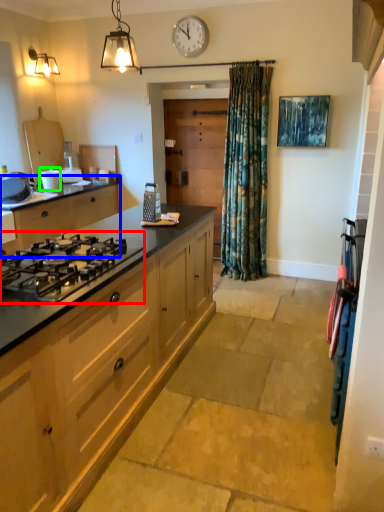
Question: Based on their relative distances, which object is farther from gas stove (highlighted by a red box)? Choose from cabinetry (highlighted by a blue box) and appliance (highlighted by a green box).

Choices:
 (A) cabinetry
 (B) appliance

Answer: (B)